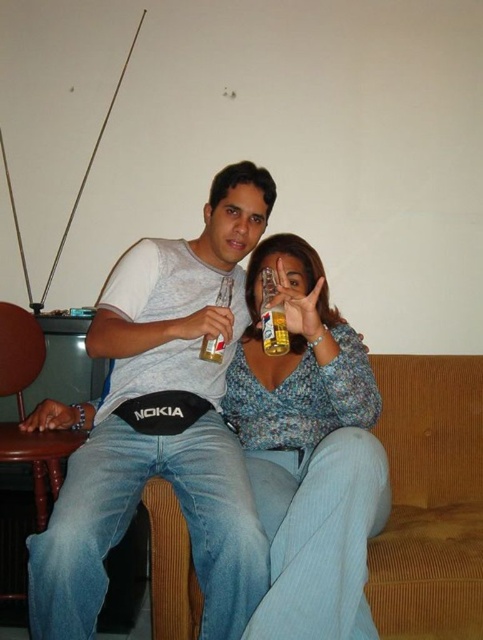
You are a photographer standing in front of the couch. You want to take a closeup photo of the white cotton shirt at center. Can you reach it with your hand without moving the people on the couch?

The white cotton shirt at center is 1.16 meters away from viewer. Since the average human arm length is about 0.7 meters, you cannot reach it without moving the people on the couch.

You are standing in front of the couch where two people are sitting. There is a point marked at coordinates (142, 403). Can you reach this point without moving closer than 1.5 meters to the couch?

The point at (142, 403) is 1.57 meters away from the viewer. Since 1.57 meters is slightly more than 1.5 meters, you can reach it without moving closer than 1.5 meters to the couch.